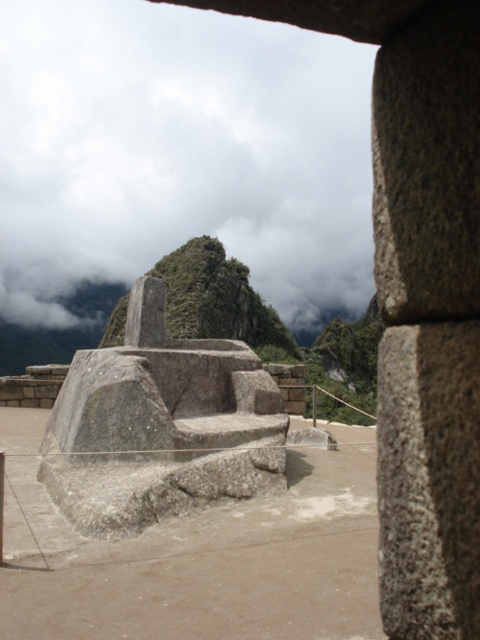
You are a tourist standing at the base of the ancient Incan stone structure. You notice the white fluffy cloud at upper center and the gray stone seat at center. Which object is closer to you, the tourist?

The gray stone seat at center is behind the white fluffy cloud at upper center, so the white fluffy cloud at upper center is closer to you.

You are a photographer standing at the base of the ancient Incan stone structure. You want to capture a photo of the white fluffy cloud at upper center in the sky. The camera you are using has a maximum focus range of 80 meters. Will the cloud be in focus?

The white fluffy cloud at upper center is 84.51 meters from the camera, which exceeds the maximum focus range of 80 meters. Therefore, the cloud will not be in focus.

You are an archaeologist examining the ancient Incan site. You notice the white fluffy cloud at upper center and the gray stone seat at center. Which object is larger in size?

The white fluffy cloud at upper center is bigger than the gray stone seat at center.